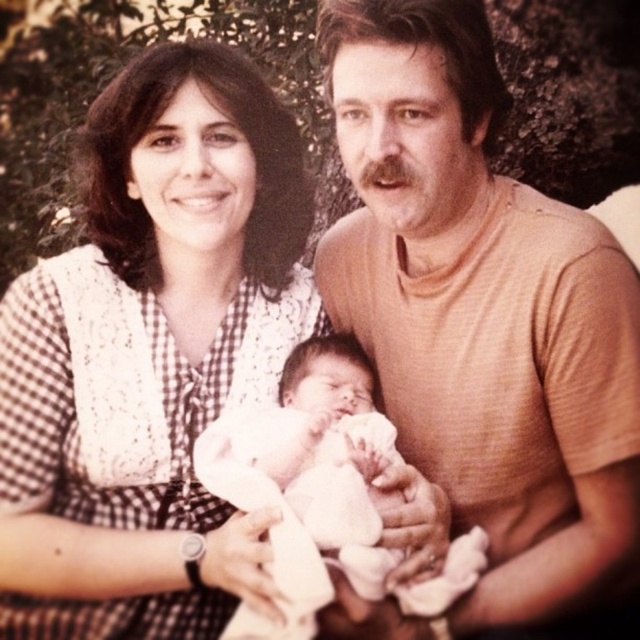
Is white checkered dress at center positioned before orange smooth t-shirt at center?

No, it is not.

Between white checkered dress at center and orange smooth t-shirt at center, which one has more height?

Standing taller between the two is white checkered dress at center.

Which is in front, point (244, 179) or point (604, 596)?

Point (604, 596) is more forward.

Find the location of a particular element. white checkered dress at center is located at coordinates (150, 355).

You are a GUI agent. You are given a task and a screenshot of the screen. Output one action in this format:
    pyautogui.click(x=<x>, y=<y>)
    Task: Click on the white checkered dress at center
    Image resolution: width=640 pixels, height=640 pixels.
    Given the screenshot: What is the action you would take?
    pyautogui.click(x=150, y=355)

Consider the image. Does orange smooth t-shirt at center appear under white soft cloth at center?

No, orange smooth t-shirt at center is not below white soft cloth at center.

Where is `orange smooth t-shirt at center`? orange smooth t-shirt at center is located at coordinates (483, 312).

Where is `orange smooth t-shirt at center`? orange smooth t-shirt at center is located at coordinates (483, 312).